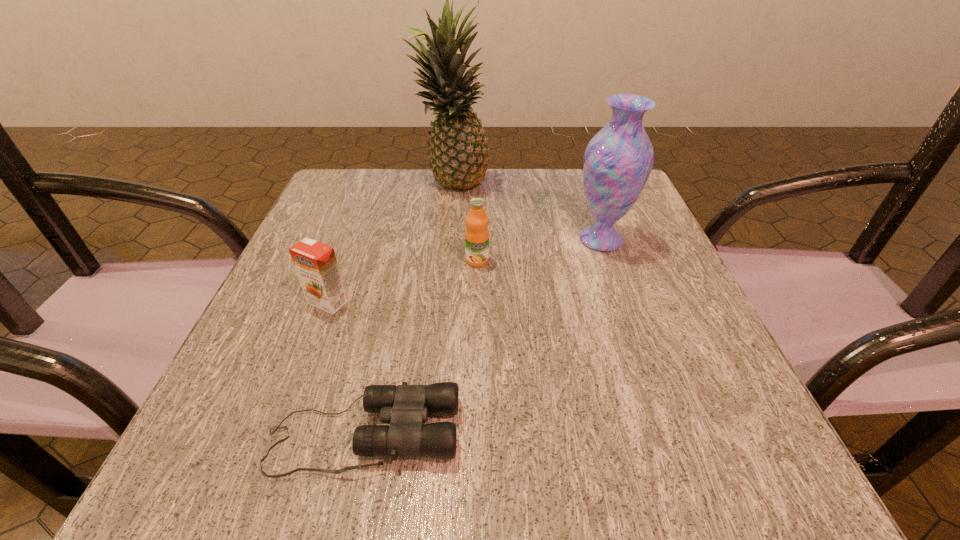
This screenshot has height=540, width=960. In order to click on free region that satisfies the following two spatial constraints: 1. on the front side of the tallest object; 2. at the eyepiece of the shortest object in this screenshot , I will do `click(428, 434)`.